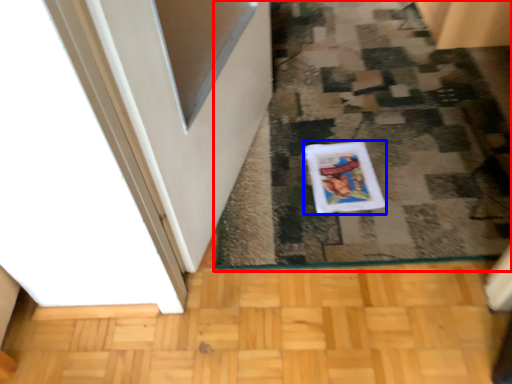
Question: Which of the following is the farthest to the observer, doormat (highlighted by a red box) or comic book (highlighted by a blue box)?

Choices:
 (A) doormat
 (B) comic book

Answer: (B)